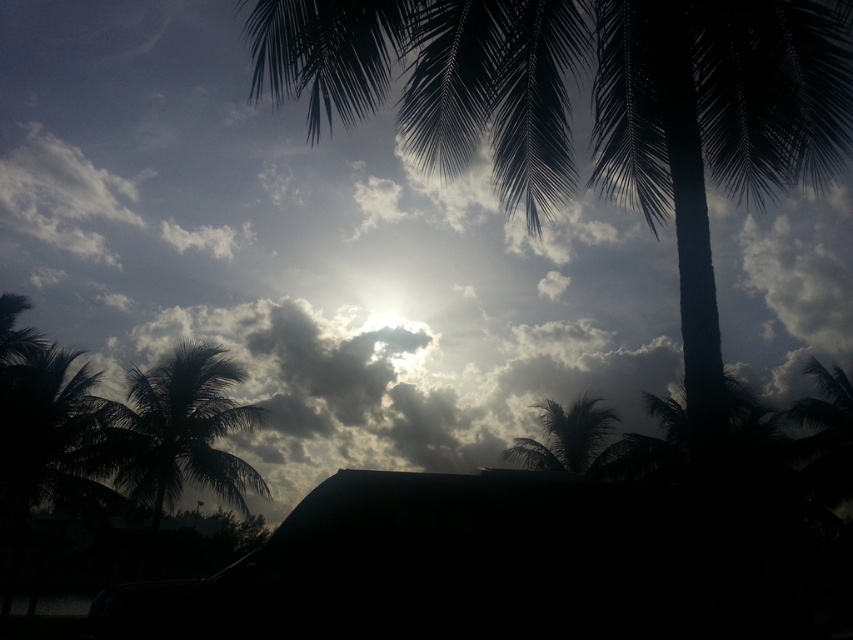
Question: Based on their relative distances, which object is nearer to the silky green palm tree at center?

Choices:
 (A) silhouette leafy tree at center
 (B) silhouette leafy palm at left

Answer: (B)

Question: Which of the following is the farthest from the observer?

Choices:
 (A) silky green palm tree at center
 (B) silhouette leafy palm at left

Answer: (A)

Question: Where is silhouette leafy palm at left located in relation to silky green palm tree at center in the image?

Choices:
 (A) right
 (B) left

Answer: (B)

Question: Is silhouette leafy tree at center above silhouette leafy palm at left?

Choices:
 (A) yes
 (B) no

Answer: (A)

Question: Can you confirm if silhouette leafy palm at left is thinner than silky green palm tree at center?

Choices:
 (A) no
 (B) yes

Answer: (A)

Question: Which object appears farthest from the camera in this image?

Choices:
 (A) silhouette leafy palm at left
 (B) silky green palm tree at center

Answer: (B)